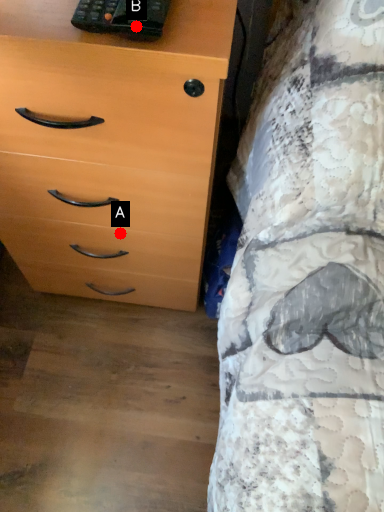
Question: Two points are circled on the image, labeled by A and B beside each circle. Among these points, which one is farthest from the camera?

Choices:
 (A) A is further
 (B) B is further

Answer: (A)